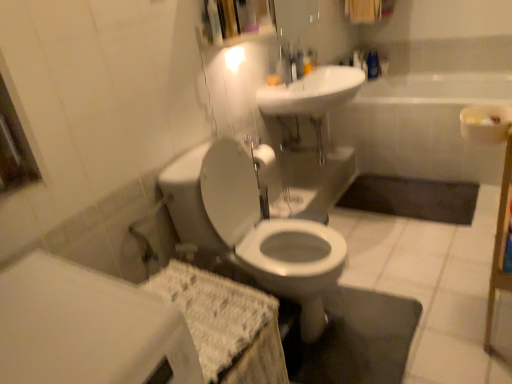
Where is `free space in front of dark gray rubber bath mat at lower center`? Image resolution: width=512 pixels, height=384 pixels. free space in front of dark gray rubber bath mat at lower center is located at coordinates (423, 244).